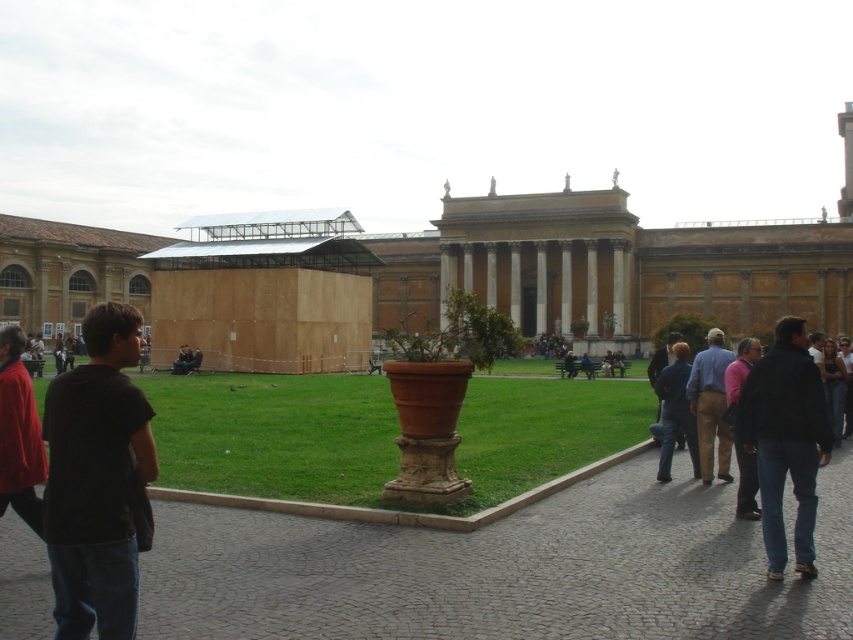
You are a landscape architect designing a garden around the historical building. You need to ensure that the green grass at center is visible from the main entrance. Given the presence of the brown wooden structure at center, will the grass be obscured by the structure?

The brown wooden structure at center is much taller than the green grass at center, so it will likely block the view of the grass from the main entrance.

You are a visitor standing at the entrance of the historical building. You notice a cobblestone path at center and dark blue jeans at lower right. Which object is closer to your current position?

The cobblestone path at center is closer to your current position because it is positioned under the dark blue jeans at lower right, indicating it is in front of the jeans.